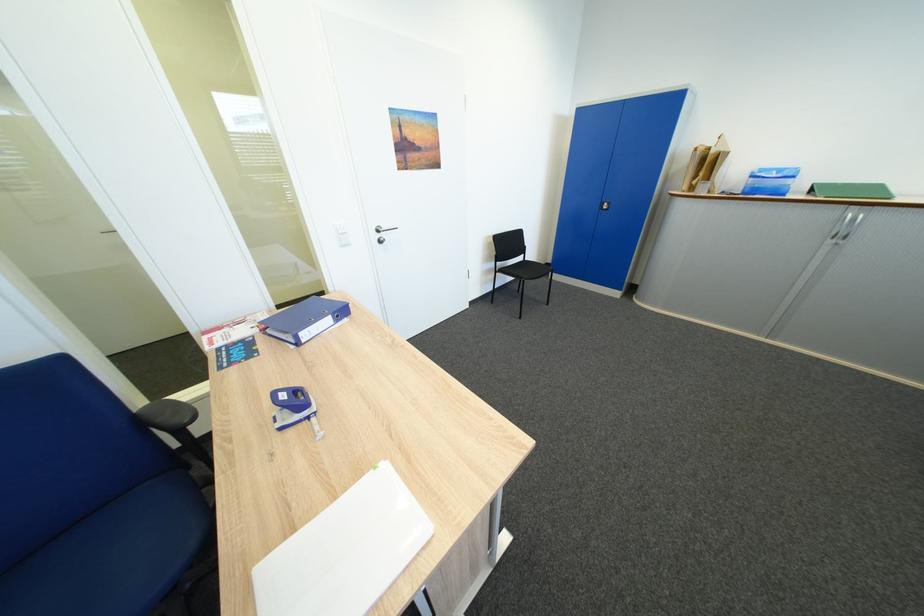
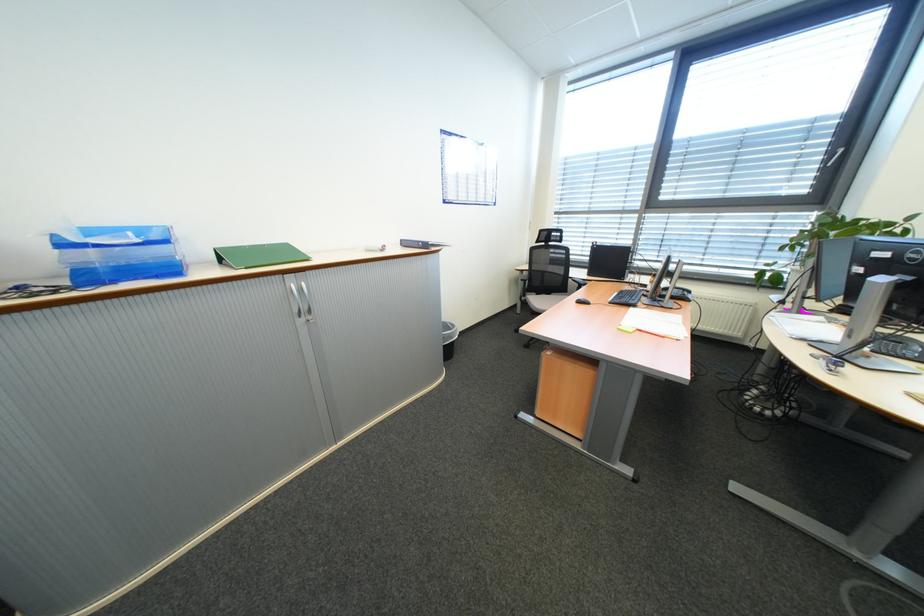
In the second image, find the point that corresponds to (891,188) in the first image.

(297, 249)